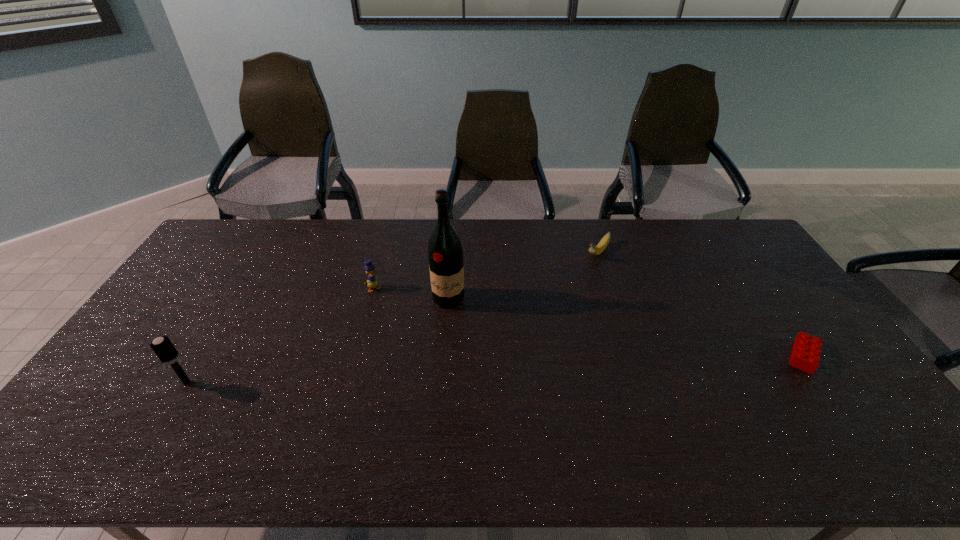
Identify the location of vacant spot on the desktop that is between the nearest object and the fourth farthest object and is positioned on the face of the duckling, where the monocle is placed. The width and height of the screenshot is (960, 540). (427, 373).

Identify the location of free space on the desktop that is between the leftmost object and the Lego and is positioned on the front-facing side of the liquor. (429, 372).

Identify the location of free spot on the desktop that is between the leftmost object and the shortest object and is positioned at the stem of the fourth object from left to right. The image size is (960, 540). (492, 369).